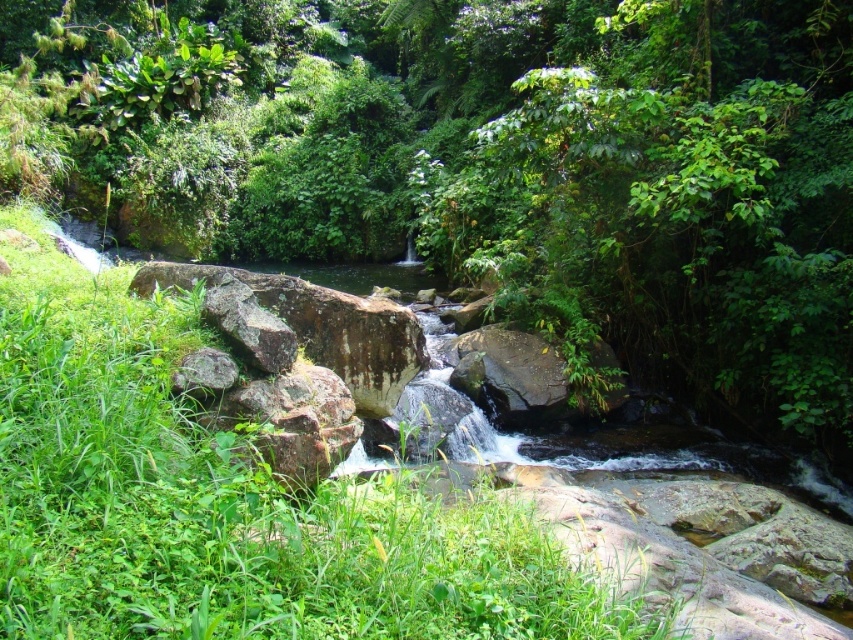
Question: Which point appears farthest from the camera in this image?

Choices:
 (A) (550, 97)
 (B) (73, 408)

Answer: (A)

Question: Where is green leafy tree at center located in relation to green grass at lower left in the image?

Choices:
 (A) left
 (B) right

Answer: (A)

Question: Among these points, which one is nearest to the camera?

Choices:
 (A) (508, 268)
 (B) (107, 531)

Answer: (B)

Question: Can you confirm if green leafy tree at center is positioned to the left of green grass at lower left?

Choices:
 (A) yes
 (B) no

Answer: (A)

Question: Does green leafy tree at center have a lesser width compared to green grass at lower left?

Choices:
 (A) yes
 (B) no

Answer: (B)

Question: Which point is closer to the camera?

Choices:
 (A) (811, 304)
 (B) (318, 515)

Answer: (B)